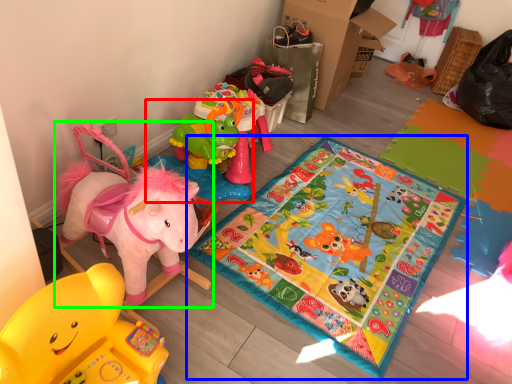
Question: Based on their relative distances, which object is nearer to toy (highlighted by a red box)? Choose from yoga mat (highlighted by a blue box) and toy (highlighted by a green box).

Choices:
 (A) yoga mat
 (B) toy

Answer: (A)